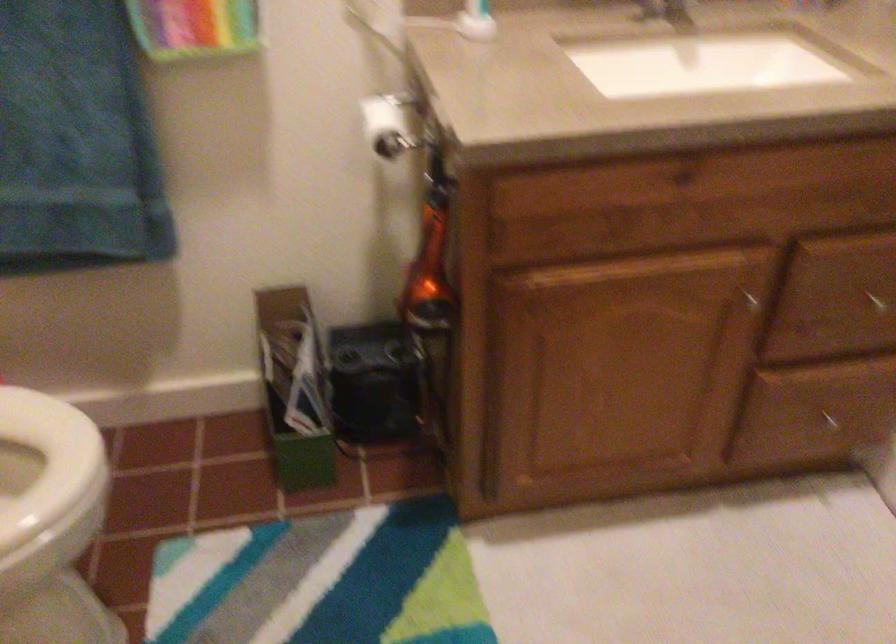
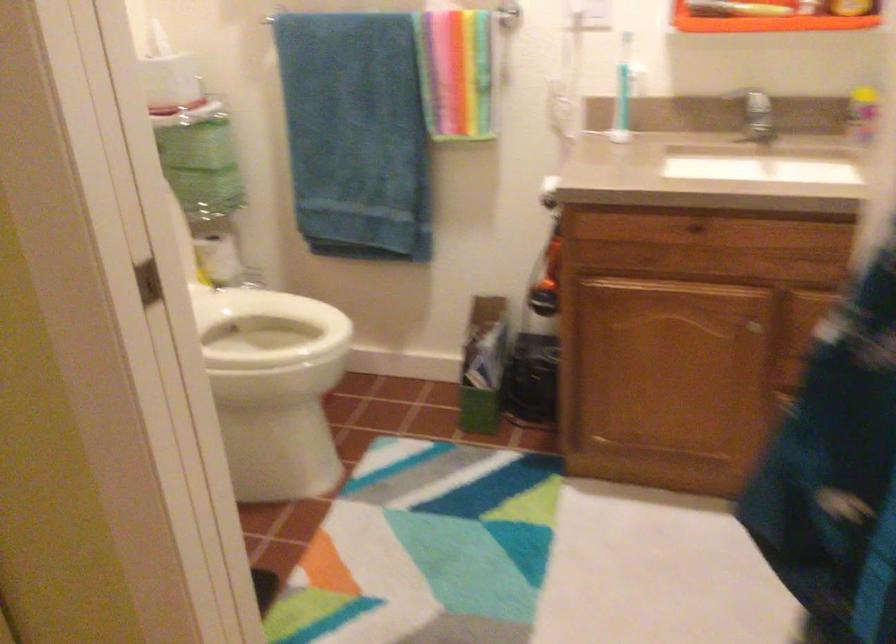
In the second image, find the point that corresponds to point (659, 182) in the first image.

(692, 229)